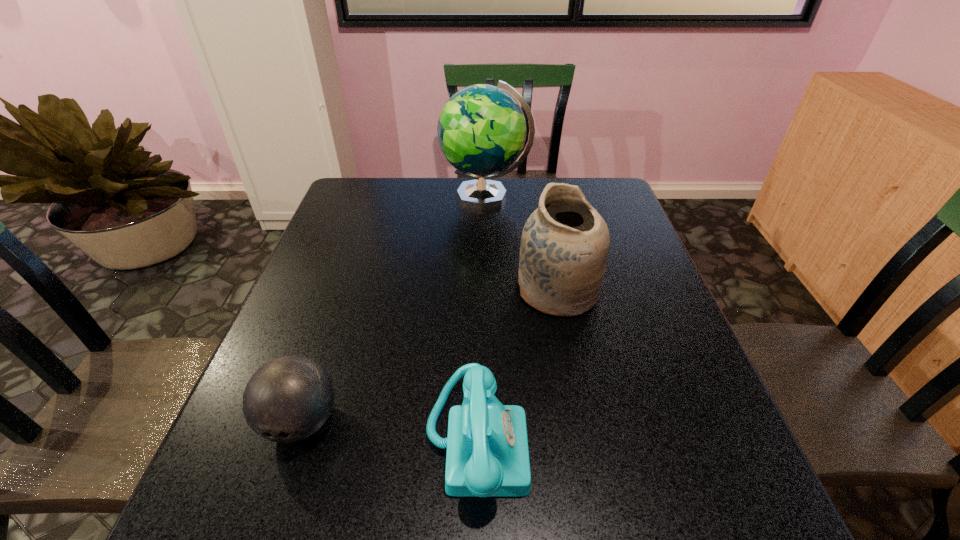
Find the location of a particular element. free space located 0.110m on the grip area of the bowling ball is located at coordinates (265, 528).

Identify the location of vacant space located on the dial of the telephone. (671, 442).

The image size is (960, 540). I want to click on object at the far edge, so click(481, 130).

The width and height of the screenshot is (960, 540). Identify the location of object that is at the near edge. (487, 455).

The image size is (960, 540). I want to click on object located in the left edge section of the desktop, so click(289, 398).

Where is `free space at the far edge of the desktop`? free space at the far edge of the desktop is located at coordinates (449, 179).

You are a GUI agent. You are given a task and a screenshot of the screen. Output one action in this format:
    pyautogui.click(x=<x>, y=<y>)
    Task: Click on the vacant space at the left edge
    
    Given the screenshot: What is the action you would take?
    pyautogui.click(x=376, y=224)

Where is `free space at the right edge of the desktop`? Image resolution: width=960 pixels, height=540 pixels. free space at the right edge of the desktop is located at coordinates (657, 275).

Locate an element on the screen. This screenshot has width=960, height=540. free space at the far right corner of the desktop is located at coordinates (608, 184).

The image size is (960, 540). I want to click on vacant space in between the globe and the leftmost object, so click(x=394, y=309).